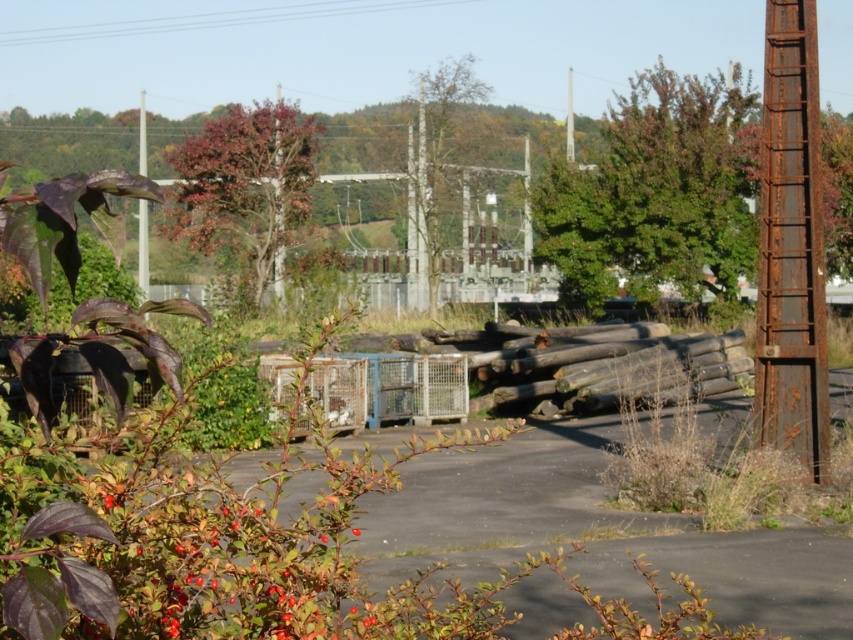
Who is positioned more to the left, green leafy tree at upper center or rusty metal pole at right?

rusty metal pole at right

Can you confirm if green leafy tree at upper center is positioned to the left of rusty metal pole at right?

Incorrect, green leafy tree at upper center is not on the left side of rusty metal pole at right.

Image resolution: width=853 pixels, height=640 pixels. I want to click on green leafy tree at upper center, so [x=656, y=193].

Is reddish-brown bark tree at center bigger than rusty metal pole at left?

No, reddish-brown bark tree at center is not bigger than rusty metal pole at left.

Which is above, reddish-brown bark tree at center or rusty metal pole at left?

reddish-brown bark tree at center

Does point (277, 264) lie behind point (143, 154)?

No, (277, 264) is closer to viewer.

This screenshot has width=853, height=640. I want to click on reddish-brown bark tree at center, so click(245, 184).

Does rusty metal pole at right lie in front of green leafy tree at center?

Yes.

Between rusty metal pole at right and green leafy tree at center, which one appears on the left side from the viewer's perspective?

green leafy tree at center is more to the left.

What are the coordinates of `rusty metal pole at right` in the screenshot? It's located at (791, 244).